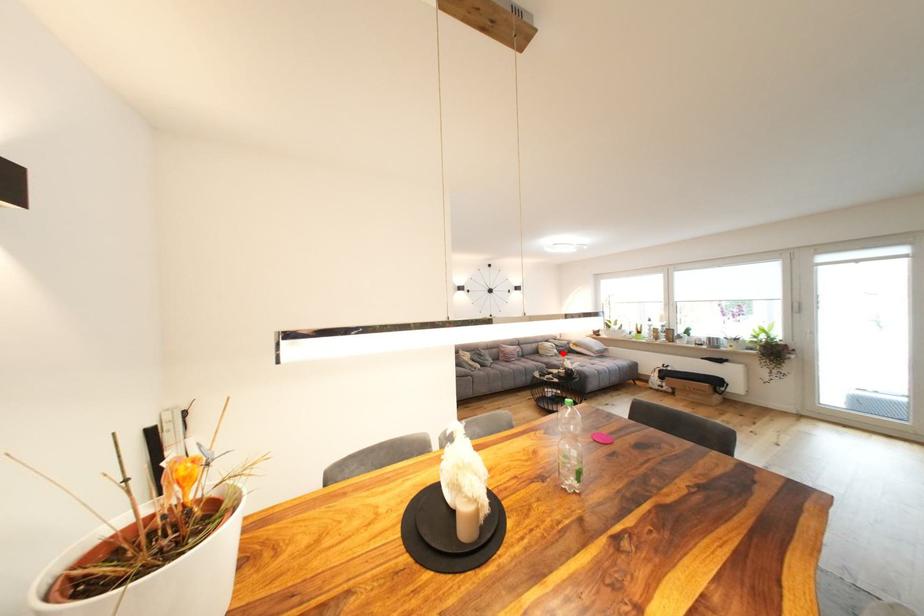
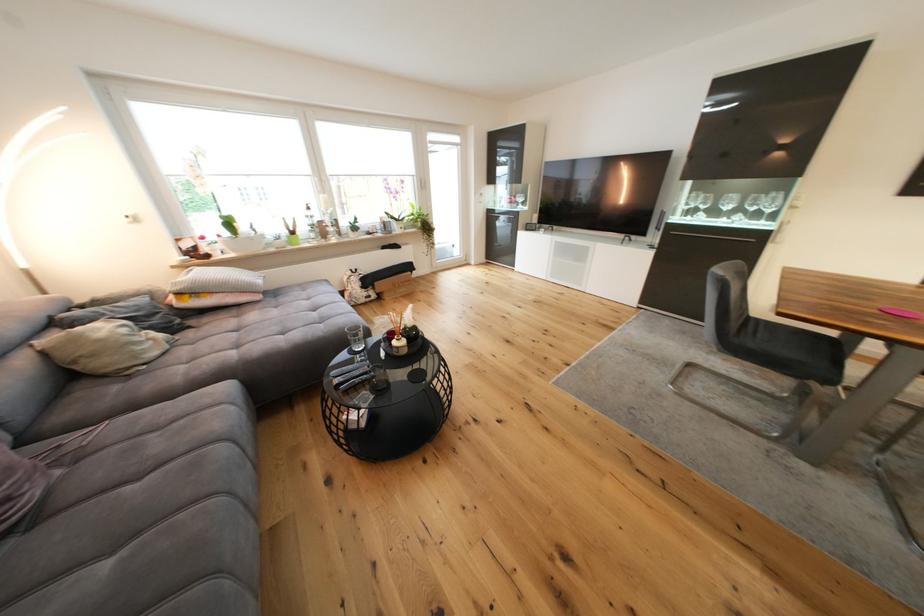
Find the pixel in the second image that matches the highlighted location in the first image.

(161, 336)